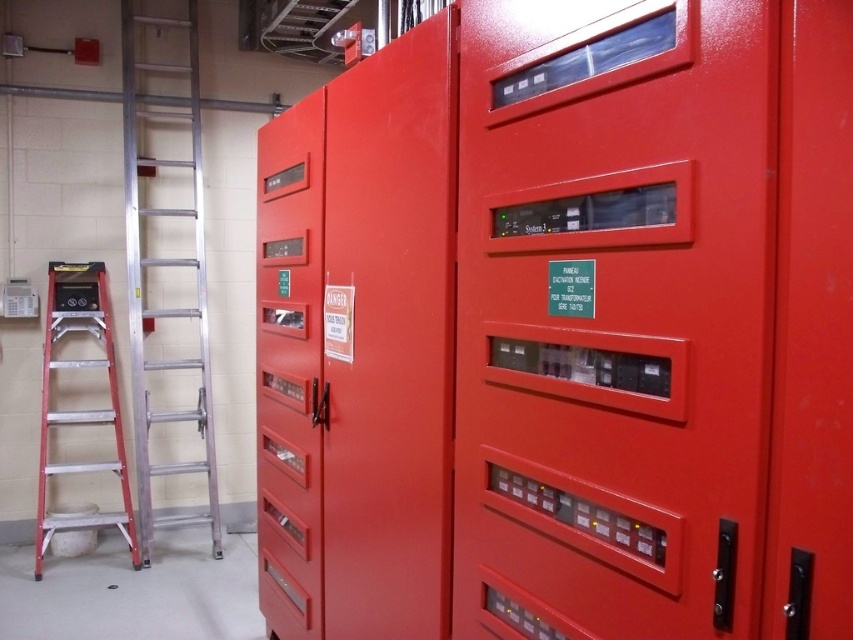
Question: Which object appears closest to the camera in this image?

Choices:
 (A) aluminum ladder at left
 (B) red aluminum ladder at left
 (C) metallic silver screwdriver at center

Answer: (C)

Question: Which object appears farthest from the camera in this image?

Choices:
 (A) red aluminum ladder at left
 (B) metallic silver screwdriver at center
 (C) glossy red locker at center

Answer: (A)

Question: Does aluminum ladder at left come behind red aluminum ladder at left?

Choices:
 (A) no
 (B) yes

Answer: (B)

Question: Can you confirm if red aluminum ladder at left is positioned to the right of metallic silver screwdriver at center?

Choices:
 (A) yes
 (B) no

Answer: (B)

Question: Which point is farther to the camera?

Choices:
 (A) (53, 422)
 (B) (323, 397)
 (C) (554, 388)

Answer: (A)

Question: Is red aluminum ladder at left to the right of metallic silver screwdriver at center from the viewer's perspective?

Choices:
 (A) yes
 (B) no

Answer: (B)